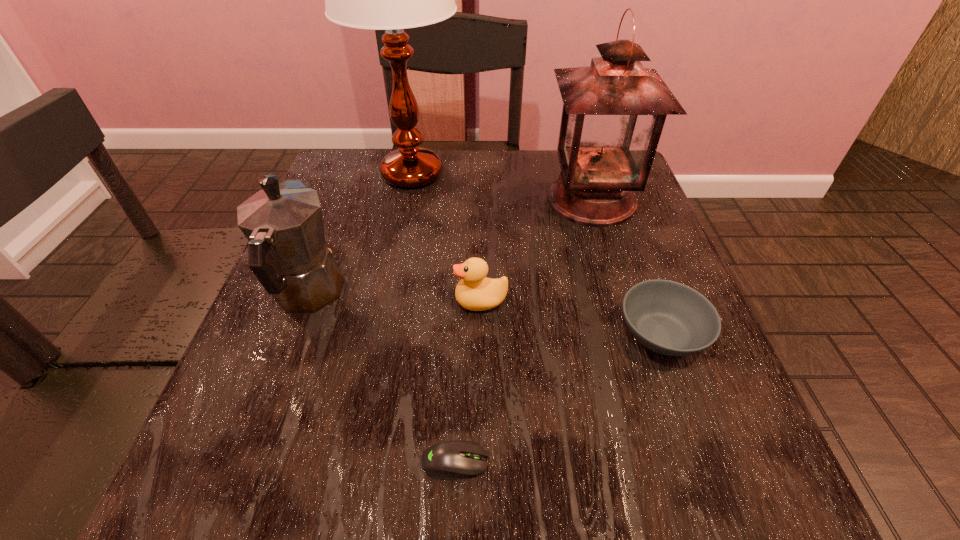
Image resolution: width=960 pixels, height=540 pixels. Identify the location of vacant position at the near right corner of the desktop. (762, 509).

The height and width of the screenshot is (540, 960). Find the location of `blank region between the shortest object and the fifth shortest object`. blank region between the shortest object and the fifth shortest object is located at coordinates (523, 331).

At what (x,y) coordinates should I click in order to perform the action: click on vacant area that lies between the tallest object and the oil lamp. Please return your answer as a coordinate pair (x, y). This screenshot has width=960, height=540. Looking at the image, I should click on (502, 187).

What are the coordinates of `unoccupied position between the fifth shortest object and the third tallest object` in the screenshot? It's located at (449, 247).

Locate an element on the screen. The image size is (960, 540). vacant area that lies between the coffeepot and the soup bowl is located at coordinates (485, 314).

This screenshot has height=540, width=960. In order to click on vacant space in between the computer mouse and the soup bowl in this screenshot , I will do `click(559, 398)`.

The width and height of the screenshot is (960, 540). I want to click on vacant space that is in between the third tallest object and the oil lamp, so click(x=449, y=247).

Find the location of a particular element. The width and height of the screenshot is (960, 540). empty space between the third tallest object and the oil lamp is located at coordinates click(449, 247).

Locate an element on the screen. Image resolution: width=960 pixels, height=540 pixels. free spot between the coffeepot and the duck is located at coordinates (395, 298).

The width and height of the screenshot is (960, 540). What are the coordinates of `blank region between the third shortest object and the third tallest object` in the screenshot? It's located at (395, 298).